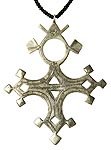
This screenshot has height=150, width=111. Find the location of `middle point of pendant`. middle point of pendant is located at coordinates (54, 86).